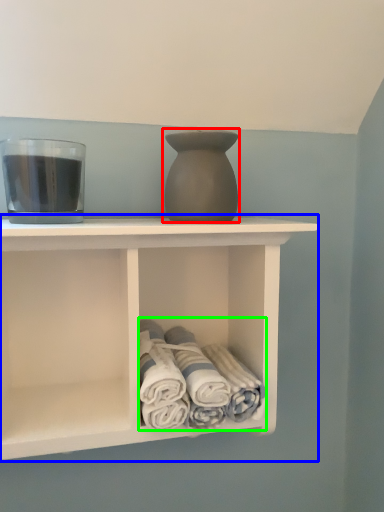
Question: Which object is positioned closest to vase (highlighted by a red box)? Select from shelf (highlighted by a blue box) and bath towel (highlighted by a green box).

Choices:
 (A) shelf
 (B) bath towel

Answer: (A)